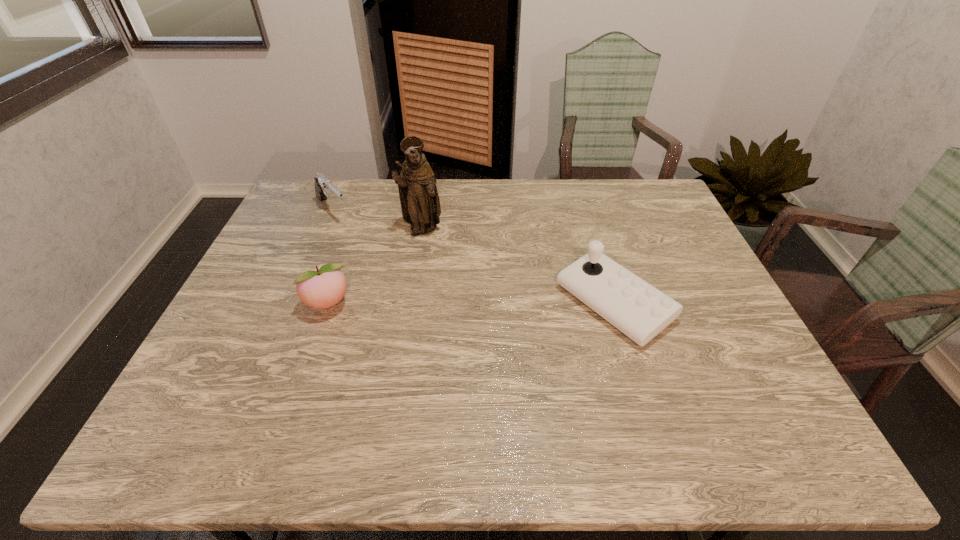
I want to click on peach, so click(325, 286).

The image size is (960, 540). Identify the location of the rightmost object. (640, 311).

Identify the location of the tallest object. The width and height of the screenshot is (960, 540). (420, 204).

At what (x,y) coordinates should I click in order to perform the action: click on the third object from left to right. Please return your answer as a coordinate pair (x, y). Image resolution: width=960 pixels, height=540 pixels. Looking at the image, I should click on (420, 204).

Image resolution: width=960 pixels, height=540 pixels. I want to click on gun, so click(323, 185).

Identify the location of free space located on the back of the peach. (363, 205).

This screenshot has width=960, height=540. I want to click on vacant space located on the right of the rightmost object, so click(x=693, y=303).

Locate an element on the screen. This screenshot has height=540, width=960. free space located 0.130m on the front-facing side of the tallest object is located at coordinates (451, 262).

Locate an element on the screen. vacant area located 0.370m on the front-facing side of the tallest object is located at coordinates point(495,315).

You are a GUI agent. You are given a task and a screenshot of the screen. Output one action in this format:
    pyautogui.click(x=<x>, y=<y>)
    Task: Click on the vacant space situated on the front-facing side of the tallest object
    
    Given the screenshot: What is the action you would take?
    pyautogui.click(x=460, y=272)